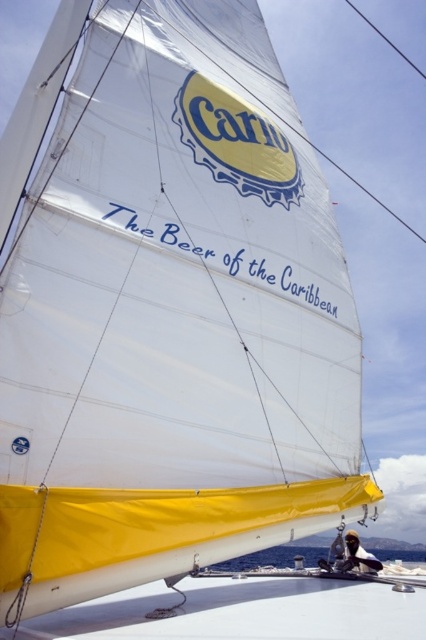
Question: Among these objects, which one is nearest to the camera?

Choices:
 (A) smooth black hair at lower right
 (B) transparent water at lower center

Answer: (B)

Question: Does transparent water at lower center appear on the left side of smooth black hair at lower right?

Choices:
 (A) yes
 (B) no

Answer: (B)

Question: Which object is farther from the camera taking this photo?

Choices:
 (A) transparent water at lower center
 (B) smooth black hair at lower right

Answer: (B)

Question: Which point is closer to the camera taking this photo?

Choices:
 (A) (348, 547)
 (B) (245, 563)

Answer: (A)

Question: Does transparent water at lower center appear on the right side of smooth black hair at lower right?

Choices:
 (A) yes
 (B) no

Answer: (A)

Question: Is transparent water at lower center further to the viewer compared to smooth black hair at lower right?

Choices:
 (A) no
 (B) yes

Answer: (A)